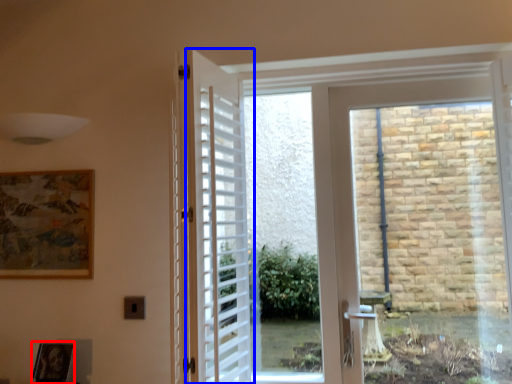
Question: Which object is further to the camera taking this photo, picture frame (highlighted by a red box) or door (highlighted by a blue box)?

Choices:
 (A) picture frame
 (B) door

Answer: (A)